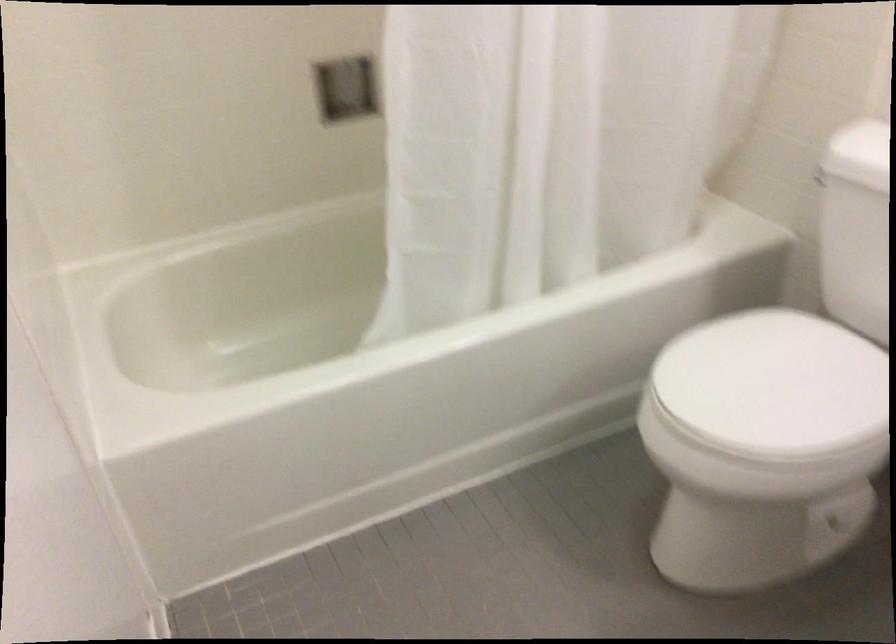
Locate an element on the screen. The image size is (896, 644). toilet flush lever is located at coordinates (819, 178).